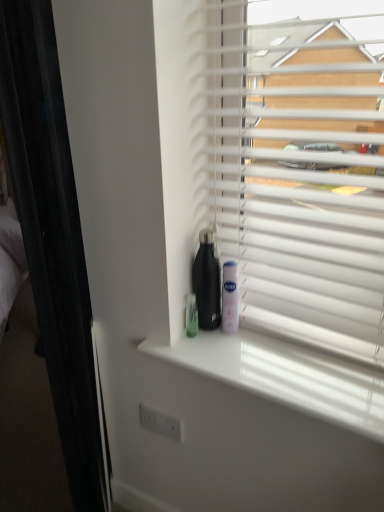
Locate an element on the screen. spots to the right of black matte water bottle at center is located at coordinates (258, 343).